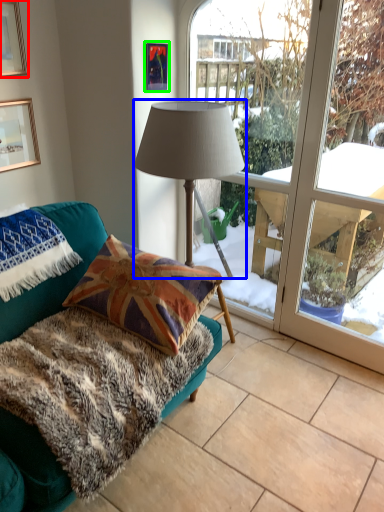
Question: Which object is the closest to the picture frame (highlighted by a red box)? Choose among these: lamp (highlighted by a blue box) or picture frame (highlighted by a green box).

Choices:
 (A) lamp
 (B) picture frame

Answer: (B)